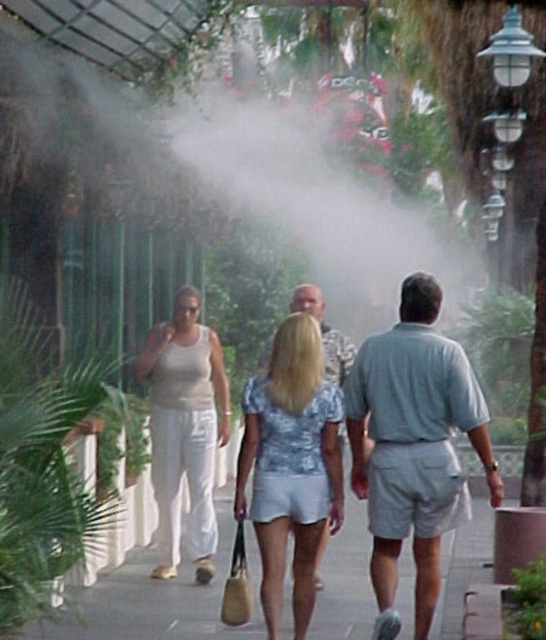
Is light blue cotton shorts at center thinner than matte white pants at left?

No, light blue cotton shorts at center is not thinner than matte white pants at left.

Which is in front, point (390, 486) or point (212, 432)?

Point (390, 486)

Where is `light blue cotton shorts at center`? light blue cotton shorts at center is located at coordinates (413, 445).

Does gray cotton shorts at center appear under gray concrete pavement at center?

No.

From the picture: Is gray cotton shorts at center to the left of gray concrete pavement at center from the viewer's perspective?

In fact, gray cotton shorts at center is to the right of gray concrete pavement at center.

Where is `gray cotton shorts at center`? This screenshot has width=546, height=640. gray cotton shorts at center is located at coordinates (412, 445).

Does gray cotton shorts at center come in front of light blue lace blouse at center?

Yes, it is in front of light blue lace blouse at center.

Consider the image. Who is taller, gray cotton shorts at center or light blue lace blouse at center?

With more height is gray cotton shorts at center.

The height and width of the screenshot is (640, 546). In order to click on gray cotton shorts at center in this screenshot , I will do `click(412, 445)`.

Locate an element on the screen. Image resolution: width=546 pixels, height=640 pixels. gray cotton shorts at center is located at coordinates (412, 445).